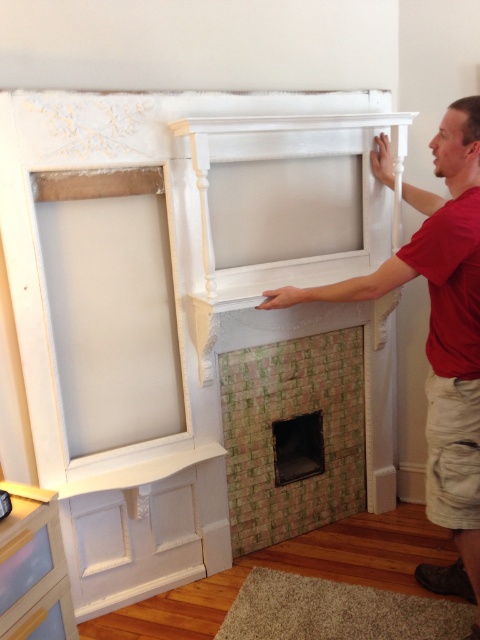
You are an interior designer assessing the renovation project. You need to determine which fireplace is bigger between the matte white fireplace at right and the green mosaic tile fireplace at center. Which one is bigger?

The matte white fireplace at right is larger in size than the green mosaic tile fireplace at center.

You are an interior designer assessing the room. You need to install a new decorative shelf that requires a support bracket. The bracket must be placed on either the white painted wood window frame at upper left or the green mosaic tile fireplace at center. Which object can better support the bracket based on their thickness?

The green mosaic tile fireplace at center is thicker than the white painted wood window frame at upper left, so it can better support the bracket.